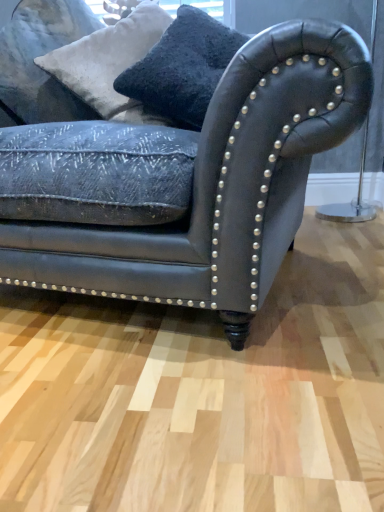
How much space does velvety black pillow at upper center, the 2th pillow when ordered from left to right, occupy horizontally?

The width of velvety black pillow at upper center, the 2th pillow when ordered from left to right, is 36.36 centimeters.

Measure the distance between white textured pillow at upper left, the first pillow viewed from the left, and camera.

white textured pillow at upper left, the first pillow viewed from the left, is 1.30 meters away from camera.

What is the approximate height of leather couch at center?

leather couch at center is 31.36 inches tall.

Locate an element on the screen. The height and width of the screenshot is (512, 384). velvety black pillow at upper center, the 2th pillow when ordered from left to right is located at coordinates (182, 68).

Is white textured pillow at upper left, the first pillow viewed from the left, a part of velvety black pillow at upper center, the 1th pillow from the right?

No, white textured pillow at upper left, the first pillow viewed from the left, is not surrounded by velvety black pillow at upper center, the 1th pillow from the right.

Measure the distance between velvety black pillow at upper center, the 1th pillow from the right, and white textured pillow at upper left, the 2th pillow in the right-to-left sequence.

A distance of 5.64 inches exists between velvety black pillow at upper center, the 1th pillow from the right, and white textured pillow at upper left, the 2th pillow in the right-to-left sequence.

Can you tell me how much velvety black pillow at upper center, the 1th pillow from the right, and white textured pillow at upper left, the first pillow viewed from the left, differ in facing direction?

The facing directions of velvety black pillow at upper center, the 1th pillow from the right, and white textured pillow at upper left, the first pillow viewed from the left, are 0.000473 degrees apart.

In terms of size, does velvety black pillow at upper center, the 1th pillow from the right, appear bigger or smaller than white textured pillow at upper left, the 2th pillow in the right-to-left sequence?

velvety black pillow at upper center, the 1th pillow from the right, is smaller than white textured pillow at upper left, the 2th pillow in the right-to-left sequence.

Do you think leather couch at center is within velvety black pillow at upper center, the 1th pillow from the right, or outside of it?

leather couch at center is not enclosed by velvety black pillow at upper center, the 1th pillow from the right.

Looking at this image, from a real-world perspective, who is located higher, leather couch at center or velvety black pillow at upper center, the 2th pillow when ordered from left to right?

velvety black pillow at upper center, the 2th pillow when ordered from left to right, from a real-world perspective.

Looking at this image, is white textured pillow at upper left, the 2th pillow in the right-to-left sequence, to the left of leather couch at center from the viewer's perspective?

Indeed, white textured pillow at upper left, the 2th pillow in the right-to-left sequence, is positioned on the left side of leather couch at center.

Which object is wider, white textured pillow at upper left, the first pillow viewed from the left, or leather couch at center?

leather couch at center.

From a real-world perspective, is white textured pillow at upper left, the first pillow viewed from the left, located higher than leather couch at center?

Yes, from a real-world perspective, white textured pillow at upper left, the first pillow viewed from the left, is over leather couch at center

Who is bigger, velvety black pillow at upper center, the 1th pillow from the right, or leather couch at center?

leather couch at center is bigger.

In terms of width, does velvety black pillow at upper center, the 1th pillow from the right, look wider or thinner when compared to leather couch at center?

Considering their sizes, velvety black pillow at upper center, the 1th pillow from the right, looks slimmer than leather couch at center.

Is velvety black pillow at upper center, the 2th pillow when ordered from left to right, aimed at leather couch at center?

Yes, velvety black pillow at upper center, the 2th pillow when ordered from left to right, faces towards leather couch at center.

What's the angular difference between velvety black pillow at upper center, the 2th pillow when ordered from left to right, and leather couch at center's facing directions?

The angle between the facing direction of velvety black pillow at upper center, the 2th pillow when ordered from left to right, and the facing direction of leather couch at center is 0.00109 degrees.

Is velvety black pillow at upper center, the 1th pillow from the right, completely or partially inside white textured pillow at upper left, the 2th pillow in the right-to-left sequence?

No, velvety black pillow at upper center, the 1th pillow from the right, is not a part of white textured pillow at upper left, the 2th pillow in the right-to-left sequence.

From a real-world perspective, relative to velvety black pillow at upper center, the 1th pillow from the right, is white textured pillow at upper left, the first pillow viewed from the left, vertically above or below?

Clearly, from a real-world perspective, white textured pillow at upper left, the first pillow viewed from the left, is above velvety black pillow at upper center, the 1th pillow from the right.

Is velvety black pillow at upper center, the 2th pillow when ordered from left to right, at the back of white textured pillow at upper left, the 2th pillow in the right-to-left sequence?

No, white textured pillow at upper left, the 2th pillow in the right-to-left sequence, is not facing away from velvety black pillow at upper center, the 2th pillow when ordered from left to right.

Could you measure the distance between white textured pillow at upper left, the first pillow viewed from the left, and velvety black pillow at upper center, the 2th pillow when ordered from left to right?

white textured pillow at upper left, the first pillow viewed from the left, and velvety black pillow at upper center, the 2th pillow when ordered from left to right, are 5.64 inches apart from each other.

From the image's perspective, is leather couch at center located beneath white textured pillow at upper left, the 2th pillow in the right-to-left sequence?

Yes, from the image's perspective, leather couch at center is below white textured pillow at upper left, the 2th pillow in the right-to-left sequence.

What's the angular difference between leather couch at center and white textured pillow at upper left, the 2th pillow in the right-to-left sequence,'s facing directions?

The facing directions of leather couch at center and white textured pillow at upper left, the 2th pillow in the right-to-left sequence, are 0.000629 degrees apart.

From a real-world perspective, between leather couch at center and white textured pillow at upper left, the 2th pillow in the right-to-left sequence, who is vertically lower?

leather couch at center.

Locate an element on the screen. pillow positioned vertically above the velvety black pillow at upper center, the 1th pillow from the right (from a real-world perspective) is located at coordinates [110, 63].

Find the location of a particular element. The width and height of the screenshot is (384, 512). studio couch that is in front of the velvety black pillow at upper center, the 1th pillow from the right is located at coordinates (218, 186).

From the image, which object appears to be farther from white textured pillow at upper left, the first pillow viewed from the left, leather couch at center or velvety black pillow at upper center, the 1th pillow from the right?

leather couch at center.

Considering their positions, is white textured pillow at upper left, the first pillow viewed from the left, positioned closer to leather couch at center than velvety black pillow at upper center, the 2th pillow when ordered from left to right?

velvety black pillow at upper center, the 2th pillow when ordered from left to right.

From the image, which object appears to be farther from velvety black pillow at upper center, the 1th pillow from the right, white textured pillow at upper left, the 2th pillow in the right-to-left sequence, or leather couch at center?

leather couch at center is further to velvety black pillow at upper center, the 1th pillow from the right.

Estimate the real-world distances between objects in this image. Which object is closer to white textured pillow at upper left, the 2th pillow in the right-to-left sequence, velvety black pillow at upper center, the 1th pillow from the right, or leather couch at center?

velvety black pillow at upper center, the 1th pillow from the right, is closer to white textured pillow at upper left, the 2th pillow in the right-to-left sequence.

Estimate the real-world distances between objects in this image. Which object is further from velvety black pillow at upper center, the 2th pillow when ordered from left to right, leather couch at center or white textured pillow at upper left, the first pillow viewed from the left?

Based on the image, leather couch at center appears to be further to velvety black pillow at upper center, the 2th pillow when ordered from left to right.

From the image, which object appears to be farther from leather couch at center, velvety black pillow at upper center, the 1th pillow from the right, or white textured pillow at upper left, the first pillow viewed from the left?

white textured pillow at upper left, the first pillow viewed from the left, is further to leather couch at center.

At what (x,y) coordinates should I click in order to perform the action: click on pillow between leather couch at center and white textured pillow at upper left, the first pillow viewed from the left, along the z-axis. Please return your answer as a coordinate pair (x, y). Looking at the image, I should click on (182, 68).